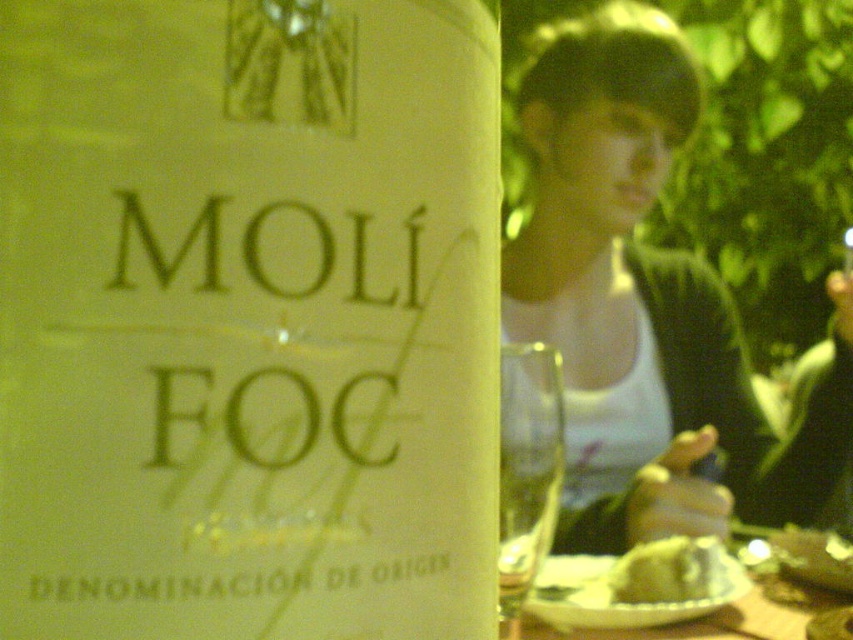
Is transparent glass wine glass at center closer to camera compared to smooth yellow cake at lower right?

Yes, transparent glass wine glass at center is closer to the viewer.

Which is in front, point (538, 387) or point (721, 573)?

Point (538, 387) is more forward.

Between point (538, 547) and point (659, 548), which one is positioned in front?

Point (538, 547) is in front.

Locate an element on the screen. transparent glass wine glass at center is located at coordinates (527, 470).

Does white cotton tank top at upper center appear under smooth yellow cake at lower right?

No.

Which is more to the right, white cotton tank top at upper center or smooth yellow cake at lower right?

Positioned to the right is white cotton tank top at upper center.

Identify the location of white cotton tank top at upper center. (647, 305).

Consider the image. How far apart are white paper bottle at center and smooth yellow cake at lower right?

The distance of white paper bottle at center from smooth yellow cake at lower right is 15.88 inches.

Between white paper bottle at center and smooth yellow cake at lower right, which one appears on the left side from the viewer's perspective?

white paper bottle at center

Who is more distant from viewer, [190,420] or [639,596]?

The point [639,596] is more distant.

Where is `white paper bottle at center`? The width and height of the screenshot is (853, 640). white paper bottle at center is located at coordinates (248, 320).